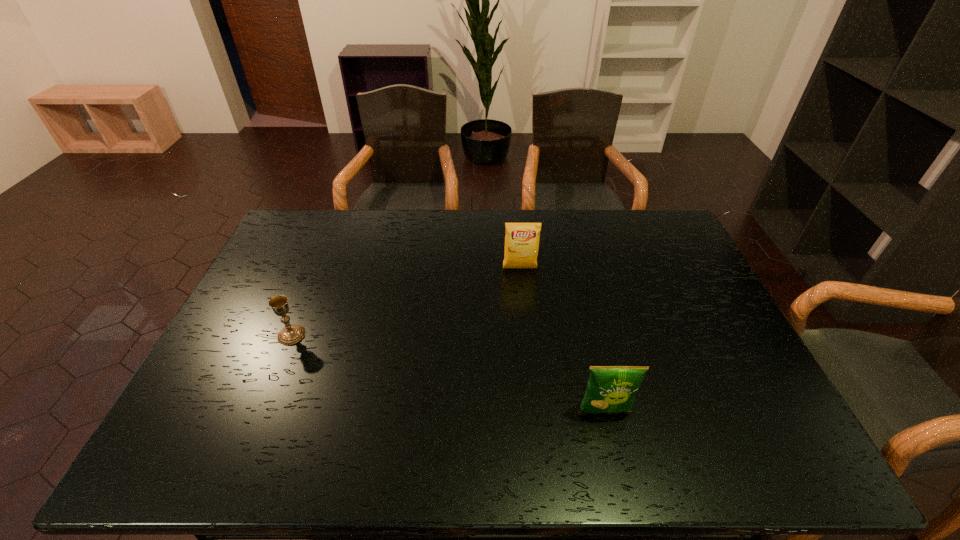
What are the coordinates of `free point between the nearer crisp (potato chip) and the farther crisp (potato chip)` in the screenshot? It's located at (562, 340).

What are the coordinates of `free space between the leftmost object and the nearer crisp (potato chip)` in the screenshot? It's located at (448, 373).

Find the location of a particular element. free space between the nearest object and the chalice is located at coordinates (448, 373).

Find the location of a particular element. vacant region between the leftmost object and the farthest object is located at coordinates (406, 302).

This screenshot has height=540, width=960. What are the coordinates of `free spot between the second nearest object and the right crisp (potato chip)` in the screenshot? It's located at (448, 373).

The height and width of the screenshot is (540, 960). In order to click on vacant area that lies between the shortest object and the rightmost object in this screenshot , I will do `click(448, 373)`.

Locate which object ranks second in proximity to the second farthest object. Please provide its 2D coordinates. Your answer should be formatted as a tuple, i.e. [(x, y)], where the tuple contains the x and y coordinates of a point satisfying the conditions above.

[(610, 388)]

At what (x,y) coordinates should I click in order to perform the action: click on the closest object to the nearer crisp (potato chip). Please return your answer as a coordinate pair (x, y). Looking at the image, I should click on (522, 239).